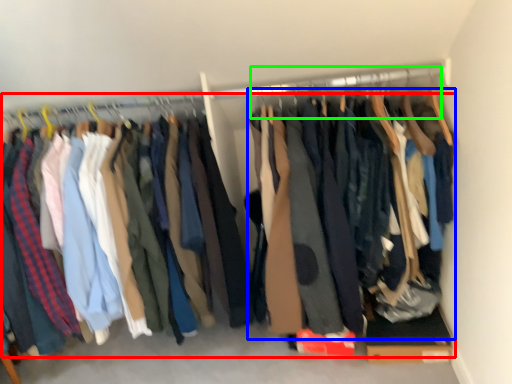
Question: Which object is positioned closest to trousers (highlighted by a red box)? Select from clothing (highlighted by a blue box) and hanger (highlighted by a green box).

Choices:
 (A) clothing
 (B) hanger

Answer: (A)